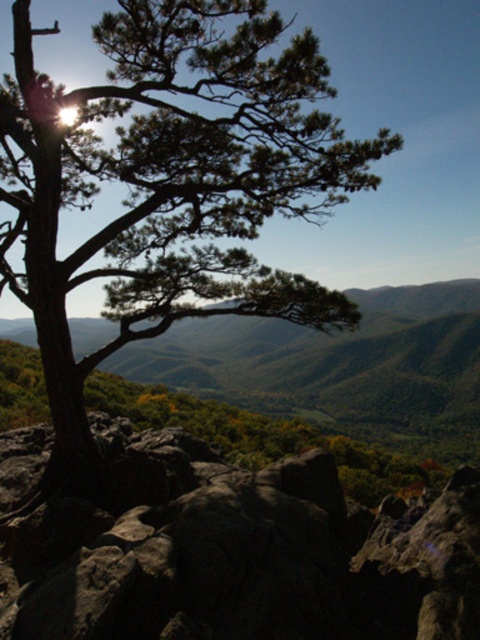
Who is positioned more to the right, green needle-like tree at center or rough textured rock at center?

From the viewer's perspective, rough textured rock at center appears more on the right side.

Can you confirm if green needle-like tree at center is thinner than rough textured rock at center?

No, green needle-like tree at center is not thinner than rough textured rock at center.

Does point (190, 65) lie in front of point (207, 472)?

Yes.

Identify the location of green needle-like tree at center. This screenshot has width=480, height=640. (169, 180).